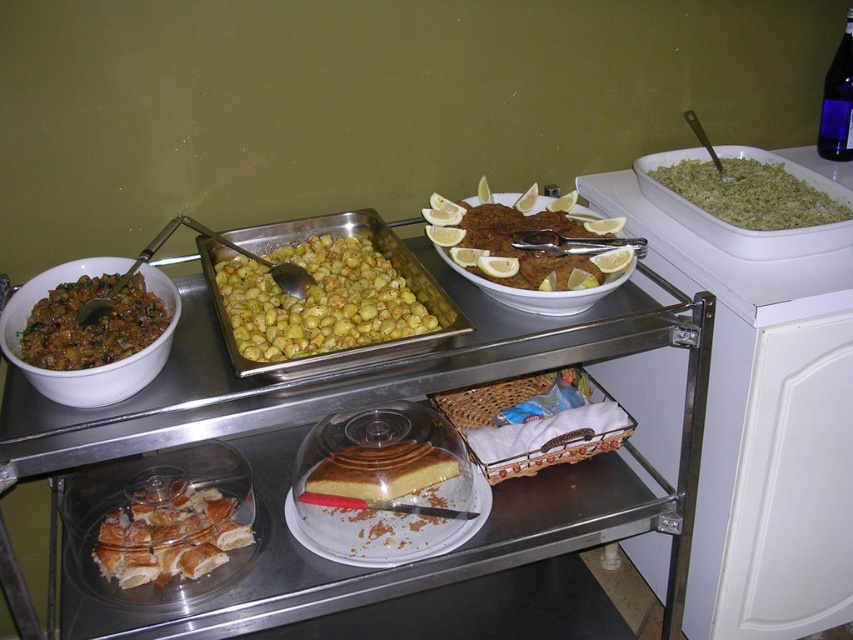
Question: Is yellow/golden/glistening potatoes at center positioned behind green rice at upper right?

Choices:
 (A) no
 (B) yes

Answer: (A)

Question: Observing the image, what is the correct spatial positioning of golden brown croissant at lower left in reference to green rice at upper right?

Choices:
 (A) above
 (B) below

Answer: (B)

Question: Which object is the closest to the brown matte rice at left?

Choices:
 (A) golden brown croissant at lower left
 (B) slightly browned crispy breaded meat at center

Answer: (A)

Question: Can you confirm if yellow/golden/glistening potatoes at center is smaller than yellow sponge cake at center?

Choices:
 (A) no
 (B) yes

Answer: (A)

Question: Among these objects, which one is nearest to the camera?

Choices:
 (A) golden brown croissant at lower left
 (B) yellow/golden/glistening potatoes at center

Answer: (B)

Question: Which of the following is the closest to the observer?

Choices:
 (A) yellow sponge cake at center
 (B) yellow/golden/glistening potatoes at center
 (C) metallic silver tray at center
 (D) green rice at upper right

Answer: (C)